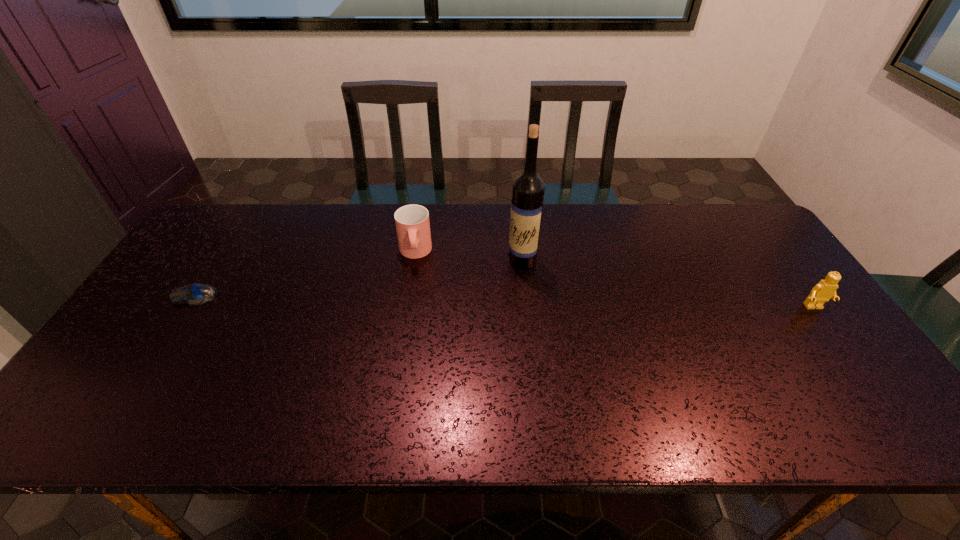
In order to click on vacant space located 0.360m on the label of the third object from left to right in this screenshot , I will do `click(407, 322)`.

Where is `free space located on the label of the third object from left to right`? free space located on the label of the third object from left to right is located at coordinates (454, 297).

Identify the location of vacant space located on the label of the third object from left to right. (436, 306).

What are the coordinates of `object located in the far edge section of the desktop` in the screenshot? It's located at (412, 222).

You are a GUI agent. You are given a task and a screenshot of the screen. Output one action in this format:
    pyautogui.click(x=<x>, y=<y>)
    Task: Click on the object that is at the left edge
    
    Given the screenshot: What is the action you would take?
    pyautogui.click(x=196, y=294)

What are the coordinates of `object that is at the right edge` in the screenshot? It's located at (826, 289).

Locate an element on the screen. Image resolution: width=960 pixels, height=540 pixels. vacant space at the far edge of the desktop is located at coordinates (499, 212).

Where is `free location at the near edge`? The image size is (960, 540). free location at the near edge is located at coordinates (x=209, y=383).

What are the coordinates of `vacant space at the left edge of the desktop` in the screenshot? It's located at (152, 361).

This screenshot has width=960, height=540. Find the location of `vacant region at the far right corner of the desktop`. vacant region at the far right corner of the desktop is located at coordinates (716, 221).